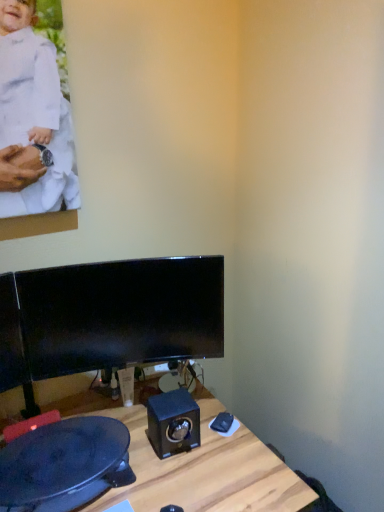
This screenshot has width=384, height=512. I want to click on free spot in front of black glossy speaker at center, so 170,481.